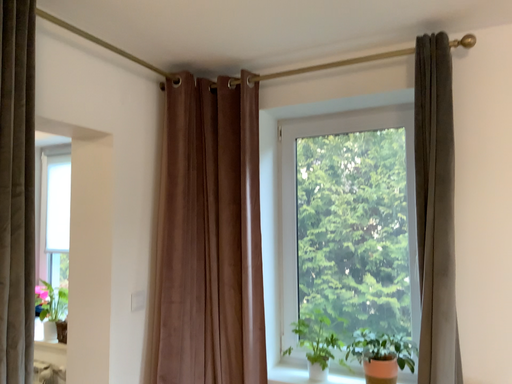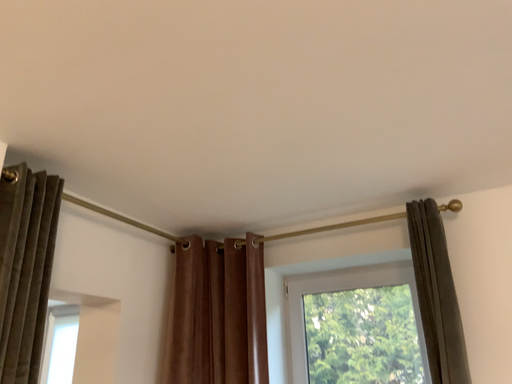
Question: Which way did the camera rotate in the video?

Choices:
 (A) rotated downward
 (B) rotated upward

Answer: (B)